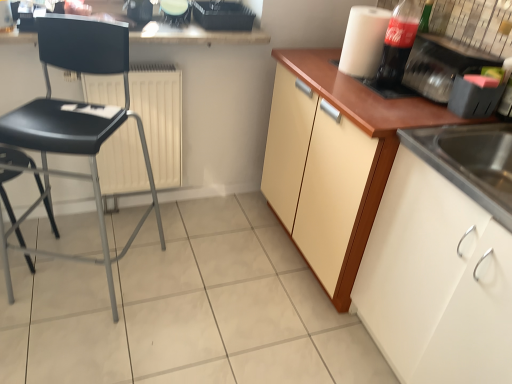
Identify the location of free space to the right of black plastic chair at left, placed as the first chair when sorted from right to left. This screenshot has height=384, width=512. (192, 290).